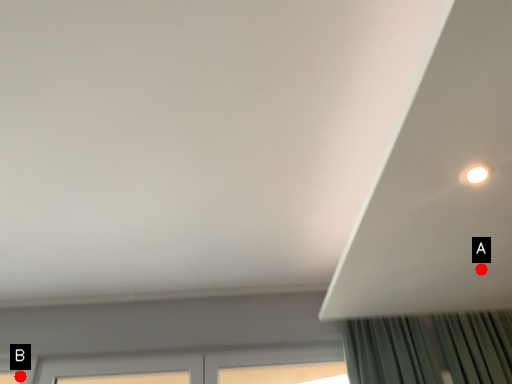
Question: Two points are circled on the image, labeled by A and B beside each circle. Which point is closer to the camera?

Choices:
 (A) A is closer
 (B) B is closer

Answer: (A)